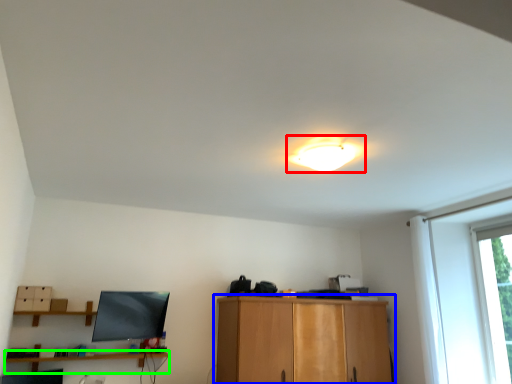
Question: Which is farther away from lamp (highlighted by a red box)? cabinetry (highlighted by a blue box) or shelf (highlighted by a green box)?

Choices:
 (A) cabinetry
 (B) shelf

Answer: (B)